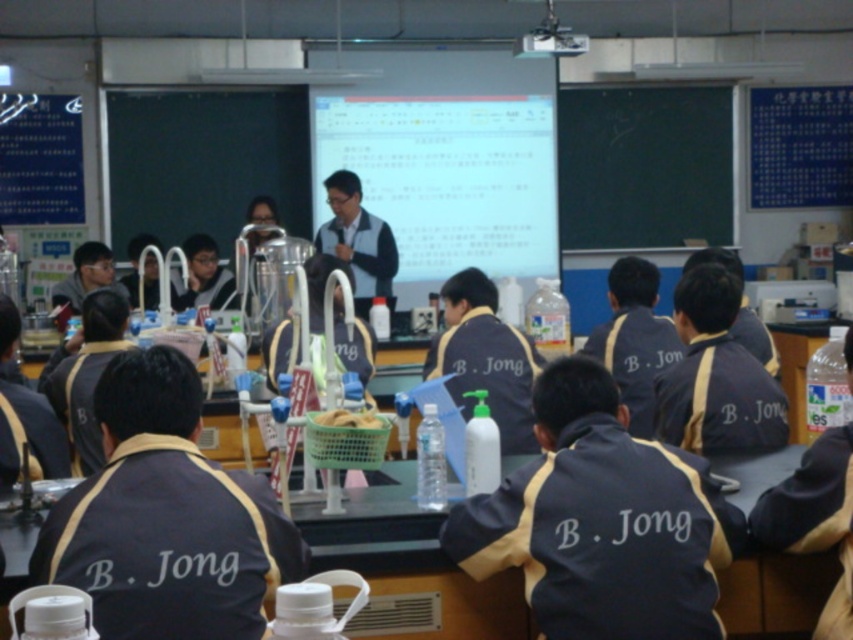
You are a student in the classroom and need to pour a chemical from the white matte bottle at center into a beaker. However, you notice the dark blue shirt at center is nearby. Considering their sizes, which object should you move first to create space?

The white matte bottle at center is smaller than the dark blue shirt at center, so you should move the dark blue shirt at center first to create enough space.